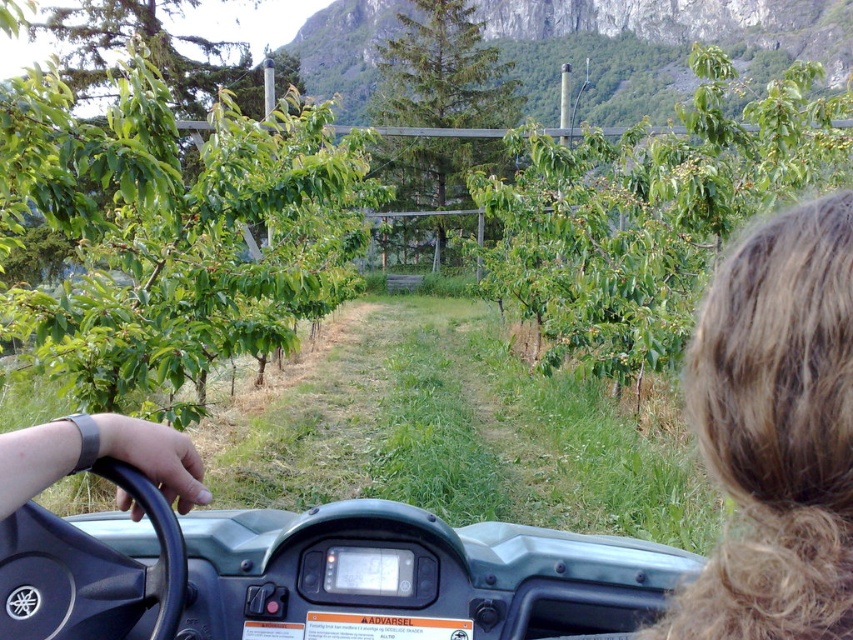
Is green matte tree at center positioned before gray rubber wristband at lower left?

No, it is behind gray rubber wristband at lower left.

Can you confirm if green matte tree at center is thinner than gray rubber wristband at lower left?

No.

At what (x,y) coordinates should I click in order to perform the action: click on green matte tree at center. Please return your answer as a coordinate pair (x, y). Looking at the image, I should click on (444, 72).

Between green leafy tree at left and green matte tree at center, which one is positioned lower?

green leafy tree at left is lower down.

Based on the photo, does green leafy tree at left have a lesser height compared to green matte tree at center?

Correct, green leafy tree at left is not as tall as green matte tree at center.

I want to click on green leafy tree at left, so click(173, 236).

Between green leafy tree at left and gray rubber wristband at lower left, which one has more height?

green leafy tree at left

This screenshot has width=853, height=640. What do you see at coordinates (173, 236) in the screenshot?
I see `green leafy tree at left` at bounding box center [173, 236].

This screenshot has width=853, height=640. What do you see at coordinates (173, 236) in the screenshot?
I see `green leafy tree at left` at bounding box center [173, 236].

Find the location of a particular element. This screenshot has height=640, width=853. green leafy tree at left is located at coordinates (173, 236).